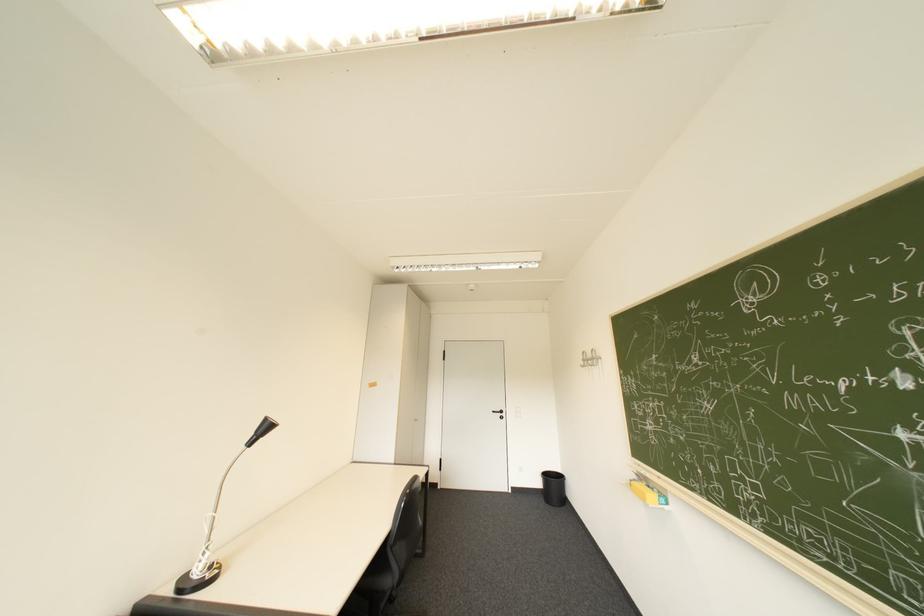
Describe the element at coordinates (260, 429) in the screenshot. I see `the black lamp head` at that location.